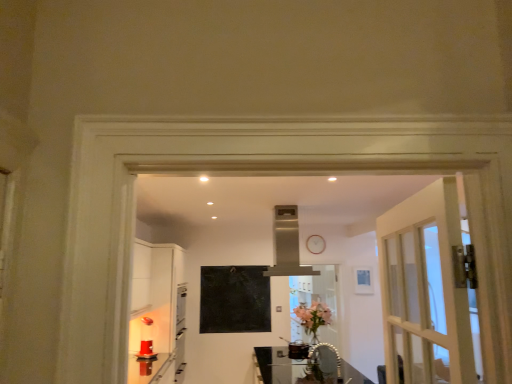
Question: From a real-world perspective, is clear glass table at center physically located above or below satin silver exhaust hood at center?

Choices:
 (A) above
 (B) below

Answer: (B)

Question: In terms of width, does clear glass table at center look wider or thinner when compared to satin silver exhaust hood at center?

Choices:
 (A) wide
 (B) thin

Answer: (A)

Question: Which object is the closest to the clear glass table at center?

Choices:
 (A) matte black bulletin board at center
 (B) pink glass vase at center
 (C) satin silver exhaust hood at center
 (D) clear glass screen door at center

Answer: (D)

Question: Which object is positioned farthest from the pink glass vase at center?

Choices:
 (A) clear glass table at center
 (B) matte black bulletin board at center
 (C) clear glass screen door at center
 (D) satin silver exhaust hood at center

Answer: (D)